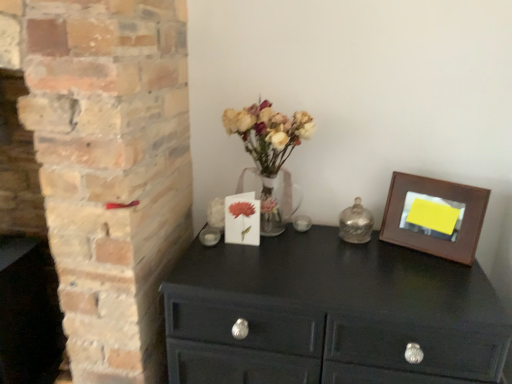
The width and height of the screenshot is (512, 384). In order to click on free space above matte black chest of drawers at center (from a real-world perspective) in this screenshot , I will do `click(329, 259)`.